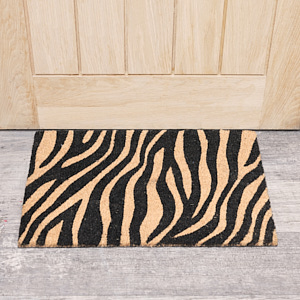
Locate an element on the screen. floor on left side of rug is located at coordinates (16, 176).